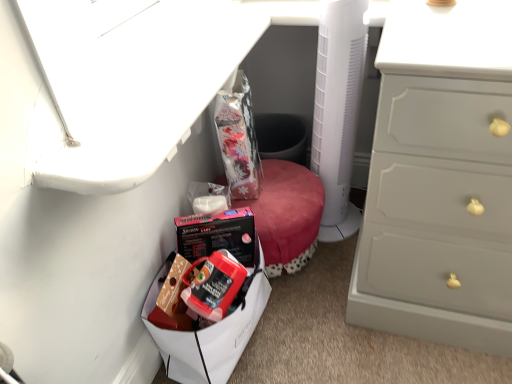
Question: Is white plastic fan at center positioned in front of metallic silver vanity at upper left?

Choices:
 (A) no
 (B) yes

Answer: (A)

Question: Is white plastic fan at center at the left side of metallic silver vanity at upper left?

Choices:
 (A) no
 (B) yes

Answer: (A)

Question: From the image's perspective, is white plastic fan at center on top of metallic silver vanity at upper left?

Choices:
 (A) yes
 (B) no

Answer: (B)

Question: Would you say metallic silver vanity at upper left is part of white plastic fan at center's contents?

Choices:
 (A) no
 (B) yes

Answer: (A)

Question: Are white plastic fan at center and metallic silver vanity at upper left far apart?

Choices:
 (A) yes
 (B) no

Answer: (B)

Question: From the image's perspective, is matte black box at lower center positioned above or below matte plastic lunch box at lower left?

Choices:
 (A) above
 (B) below

Answer: (A)

Question: Visually, is matte black box at lower center positioned to the left or to the right of matte plastic lunch box at lower left?

Choices:
 (A) left
 (B) right

Answer: (B)

Question: Looking at their shapes, would you say matte black box at lower center is wider or thinner than matte plastic lunch box at lower left?

Choices:
 (A) wide
 (B) thin

Answer: (A)

Question: Considering the positions of point (302, 223) and point (243, 291), is point (302, 223) closer or farther from the camera than point (243, 291)?

Choices:
 (A) closer
 (B) farther

Answer: (B)

Question: From the image's perspective, is matte black box at lower center positioned above or below white plastic fan at center?

Choices:
 (A) below
 (B) above

Answer: (A)

Question: Is matte black box at lower center wider or thinner than white plastic fan at center?

Choices:
 (A) wide
 (B) thin

Answer: (A)

Question: Is matte black box at lower center taller or shorter than white plastic fan at center?

Choices:
 (A) tall
 (B) short

Answer: (B)

Question: Would you say matte black box at lower center is inside or outside white plastic fan at center?

Choices:
 (A) inside
 (B) outside

Answer: (B)

Question: From the image's perspective, is matte plastic lunch box at lower left located above or below white plastic fan at center?

Choices:
 (A) below
 (B) above

Answer: (A)

Question: In terms of size, does matte plastic lunch box at lower left appear bigger or smaller than white plastic fan at center?

Choices:
 (A) big
 (B) small

Answer: (A)